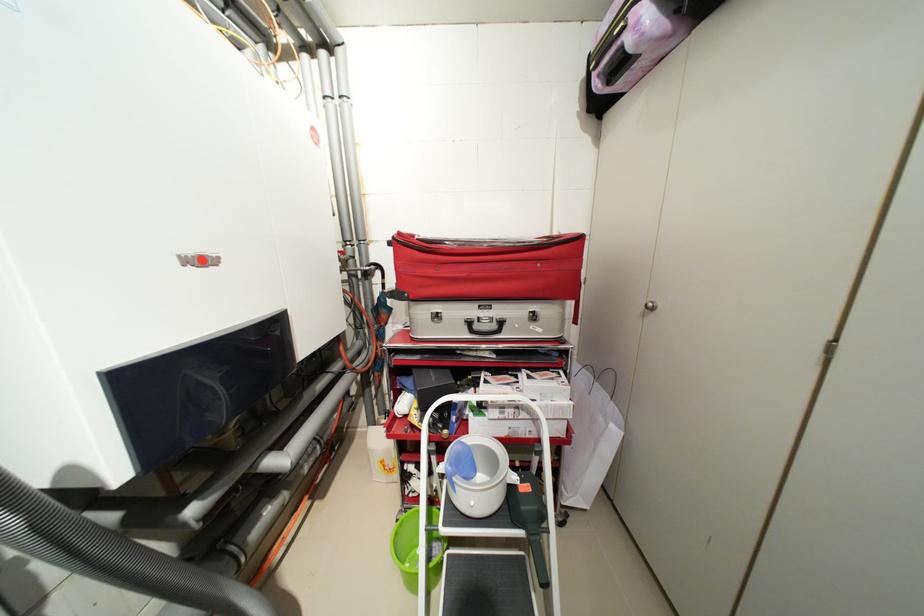
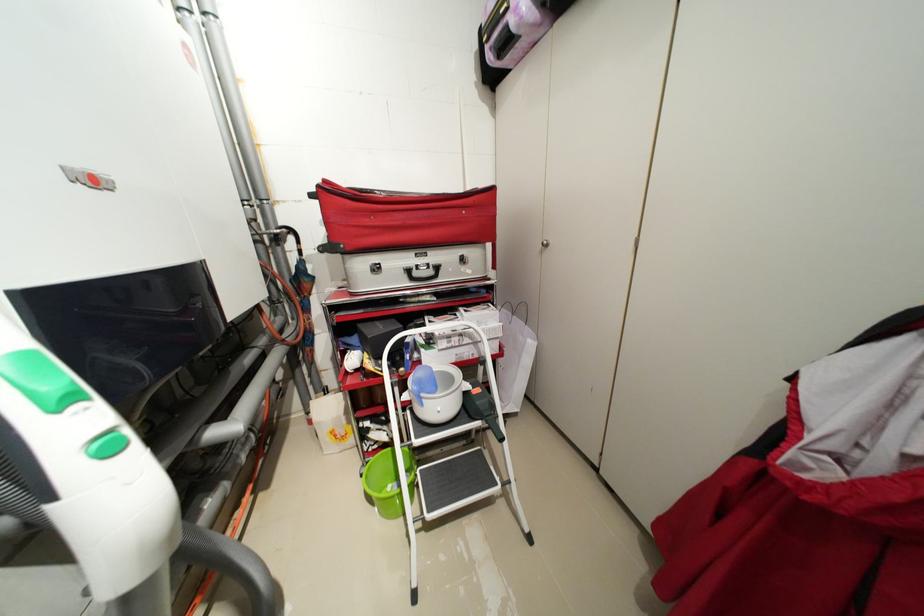
In the second image, find the point that corresponds to the point at 483,328 in the first image.

(422, 275)